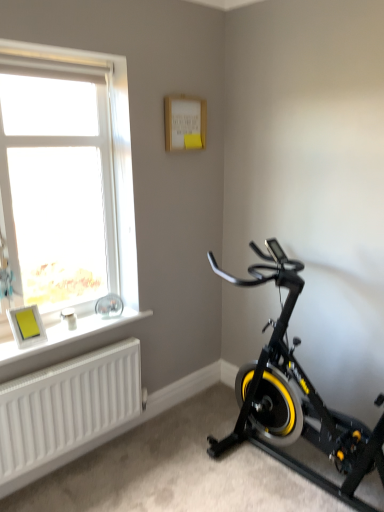
This screenshot has width=384, height=512. Identify the location of free space in front of matte yellow picture frame at lower left. (22, 350).